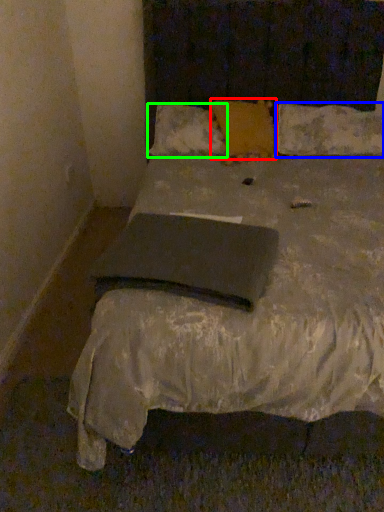
Question: Which object is positioned closest to pillow (highlighted by a red box)? Select from pillow (highlighted by a blue box) and pillow (highlighted by a green box).

Choices:
 (A) pillow
 (B) pillow

Answer: (B)